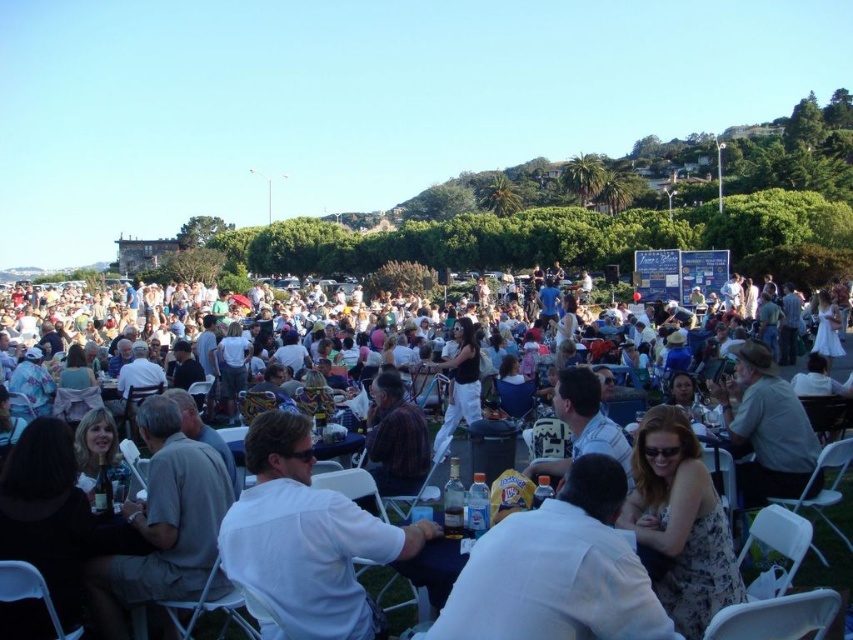
Question: Can you confirm if white plastic chairs at center is positioned to the right of white shirt at center?

Choices:
 (A) no
 (B) yes

Answer: (A)

Question: Does white plastic chairs at center lie behind white shirt at center?

Choices:
 (A) no
 (B) yes

Answer: (B)

Question: Which point is farther to the camera?

Choices:
 (A) white plastic chairs at center
 (B) white shirt at center

Answer: (A)

Question: Which point appears closest to the camera in this image?

Choices:
 (A) (303, 616)
 (B) (718, 417)

Answer: (A)

Question: Among these objects, which one is farthest from the camera?

Choices:
 (A) white plastic chairs at center
 (B) white shirt at center

Answer: (A)

Question: Where is white plastic chairs at center located in relation to white shirt at center in the image?

Choices:
 (A) right
 (B) left

Answer: (B)